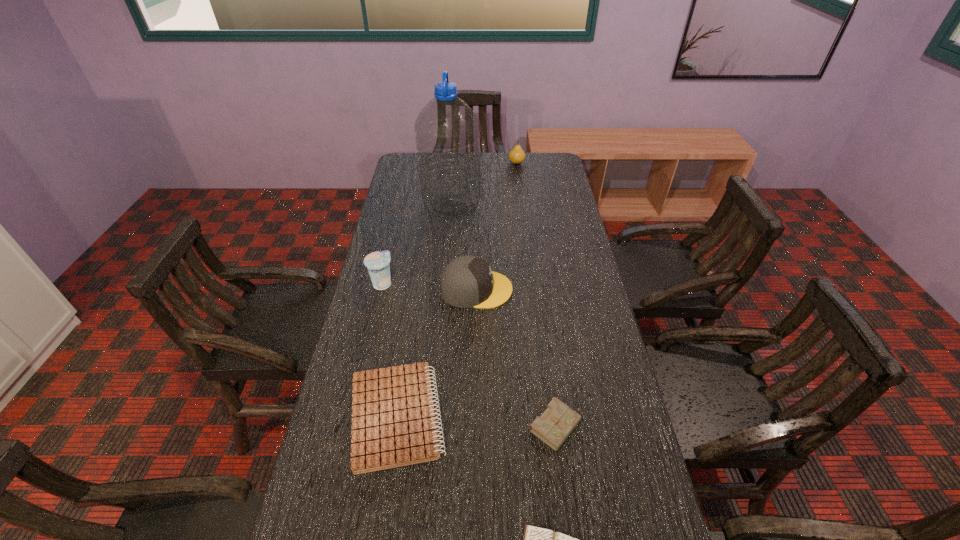
This screenshot has height=540, width=960. In order to click on free space at the left edge of the desktop in this screenshot , I will do `click(409, 215)`.

The image size is (960, 540). I want to click on vacant region at the right edge of the desktop, so 590,514.

This screenshot has width=960, height=540. I want to click on vacant point at the far right corner, so click(531, 159).

The height and width of the screenshot is (540, 960). I want to click on vacant region between the notebook and the sixth nearest object, so click(x=424, y=310).

This screenshot has width=960, height=540. Find the location of `empty location between the water jug and the cap`. empty location between the water jug and the cap is located at coordinates (465, 247).

You are a GUI agent. You are given a task and a screenshot of the screen. Output one action in this format:
    pyautogui.click(x=<x>, y=<y>)
    Task: Click on the free point between the pear and the fifth tallest object
    
    Given the screenshot: What is the action you would take?
    pyautogui.click(x=537, y=295)

Where is `free space between the yogurt and the notebook`? The image size is (960, 540). free space between the yogurt and the notebook is located at coordinates (390, 350).

Where is `vacant point located between the second shortest object and the farther diary`? Image resolution: width=960 pixels, height=540 pixels. vacant point located between the second shortest object and the farther diary is located at coordinates (477, 422).

Where is `vacant region between the second farthest object and the taller diary`? The height and width of the screenshot is (540, 960). vacant region between the second farthest object and the taller diary is located at coordinates (504, 316).

At what (x,y) coordinates should I click in order to perform the action: click on empty space between the yogurt and the taller diary. Please return your answer as a coordinate pair (x, y). The width and height of the screenshot is (960, 540). Looking at the image, I should click on (469, 355).